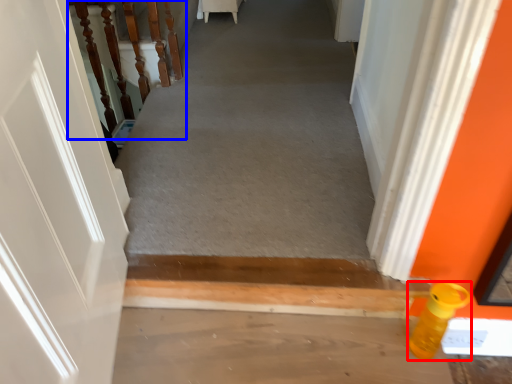
Question: Among these objects, which one is nearest to the camera, bottle (highlighted by a red box) or stairwell (highlighted by a blue box)?

Choices:
 (A) bottle
 (B) stairwell

Answer: (A)